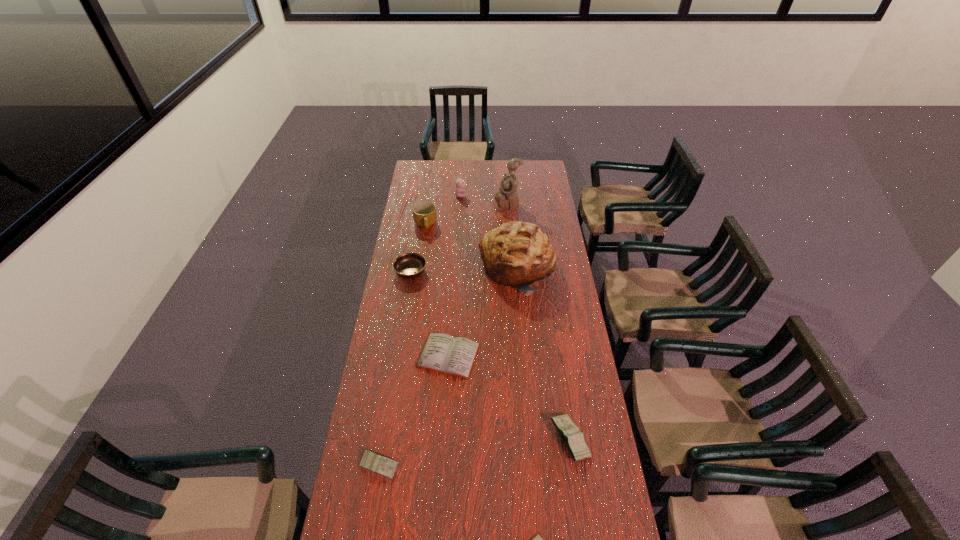
What are the coordinates of `the smaller pink diary` in the screenshot? It's located at (375, 462).

You are a GUI agent. You are given a task and a screenshot of the screen. Output one action in this format:
    pyautogui.click(x=<x>, y=<y>)
    Task: Click on the sixth farthest object
    
    Given the screenshot: What is the action you would take?
    pyautogui.click(x=453, y=355)

The height and width of the screenshot is (540, 960). I want to click on the farther white diary, so click(x=453, y=355).

Find the location of a particular element. vacant space situated on the front-facing side of the tallest object is located at coordinates (446, 204).

Locate an element on the screen. The height and width of the screenshot is (540, 960). free space located 0.370m on the front-facing side of the tallest object is located at coordinates (431, 204).

Find the location of a particular element. vacant space located on the front-facing side of the tallest object is located at coordinates (434, 204).

Find the location of a particular element. The image size is (960, 540). free region located 0.060m on the right of the second tallest object is located at coordinates (568, 268).

Identify the location of free space located 0.350m at the face of the pink teddy bear. This screenshot has width=960, height=540. (525, 195).

Where is `free point located on the side with the handle of the tan mug`? free point located on the side with the handle of the tan mug is located at coordinates (418, 280).

Where is `free space located on the front of the soup bowl`? The height and width of the screenshot is (540, 960). free space located on the front of the soup bowl is located at coordinates (399, 345).